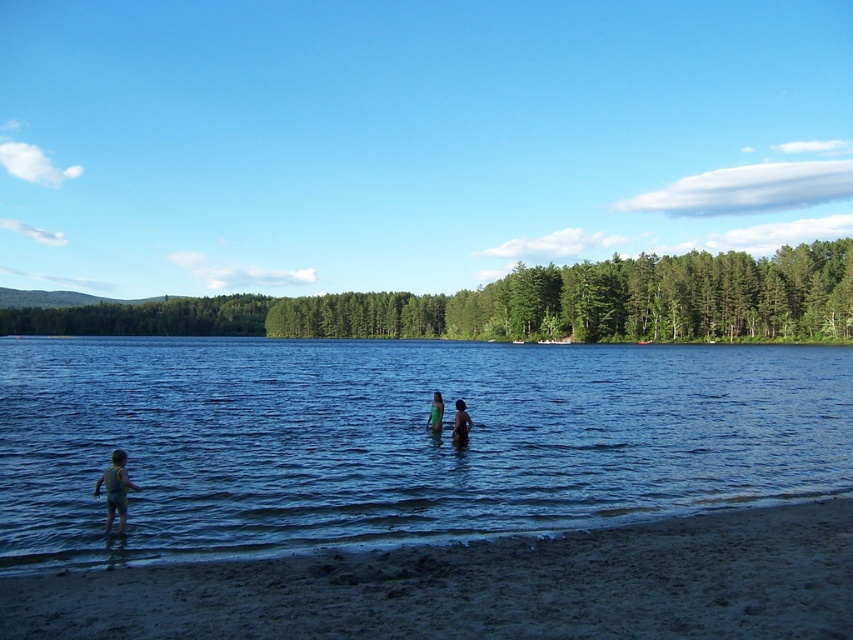
Between blue liquid water at center and dark sand at lower left, which one appears on the left side from the viewer's perspective?

From the viewer's perspective, blue liquid water at center appears more on the left side.

Is blue liquid water at center above dark sand at lower left?

Correct, blue liquid water at center is located above dark sand at lower left.

Is point (125, 376) more distant than point (460, 588)?

Yes, it is.

Image resolution: width=853 pixels, height=640 pixels. Identify the location of blue liquid water at center. (397, 440).

Which of these two, dark sand at lower left or smooth skin person at center, stands shorter?

Standing shorter between the two is smooth skin person at center.

Does dark sand at lower left have a greater height compared to smooth skin person at center?

Yes, dark sand at lower left is taller than smooth skin person at center.

Which is behind, point (730, 563) or point (456, 404)?

The point (456, 404) is more distant.

Locate an element on the screen. The height and width of the screenshot is (640, 853). dark sand at lower left is located at coordinates (482, 586).

Which is in front, point (337, 417) or point (432, 422)?

Point (432, 422)

Does blue liquid water at center have a lesser width compared to green fabric at center?

No, blue liquid water at center is not thinner than green fabric at center.

The image size is (853, 640). Describe the element at coordinates (397, 440) in the screenshot. I see `blue liquid water at center` at that location.

At what (x,y) coordinates should I click in order to perform the action: click on blue liquid water at center. Please return your answer as a coordinate pair (x, y). This screenshot has width=853, height=640. Looking at the image, I should click on (397, 440).